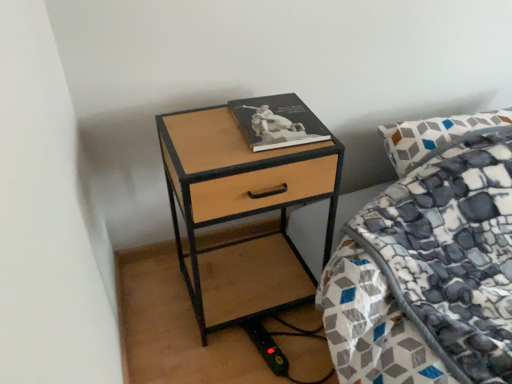
You are a GUI agent. You are given a task and a screenshot of the screen. Output one action in this format:
    pyautogui.click(x=<x>, y=<y>)
    Task: Click on the vacant area on top of woodenmaterial/texturenightstand at center (from a real-world perspective)
    This screenshot has height=384, width=512.
    Given the screenshot: What is the action you would take?
    pyautogui.click(x=242, y=129)